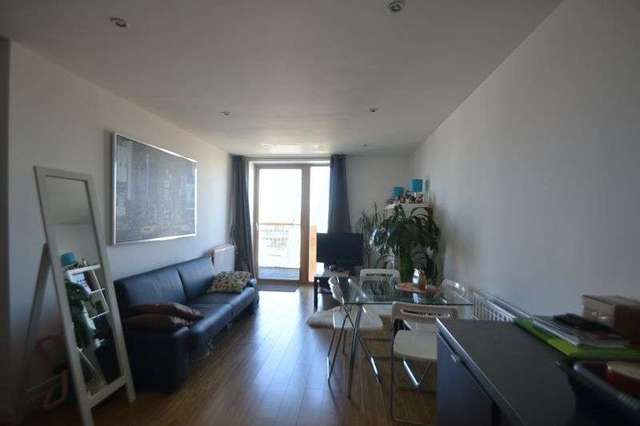
Locate an element on the screen. Image resolution: width=640 pixels, height=426 pixels. curtains is located at coordinates (241, 207), (340, 203).